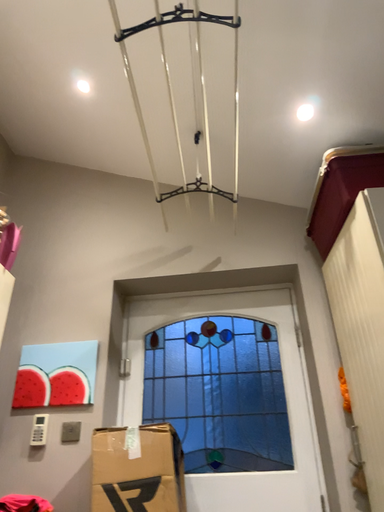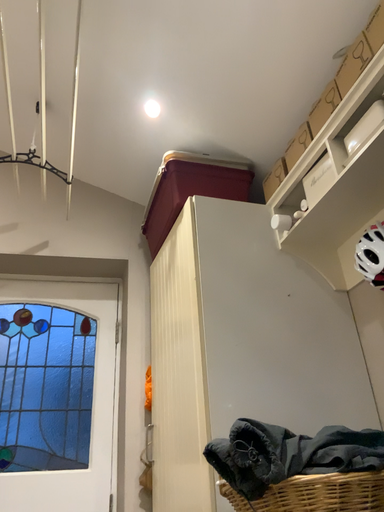
Question: How did the camera likely rotate when shooting the video?

Choices:
 (A) rotated left
 (B) rotated right

Answer: (B)